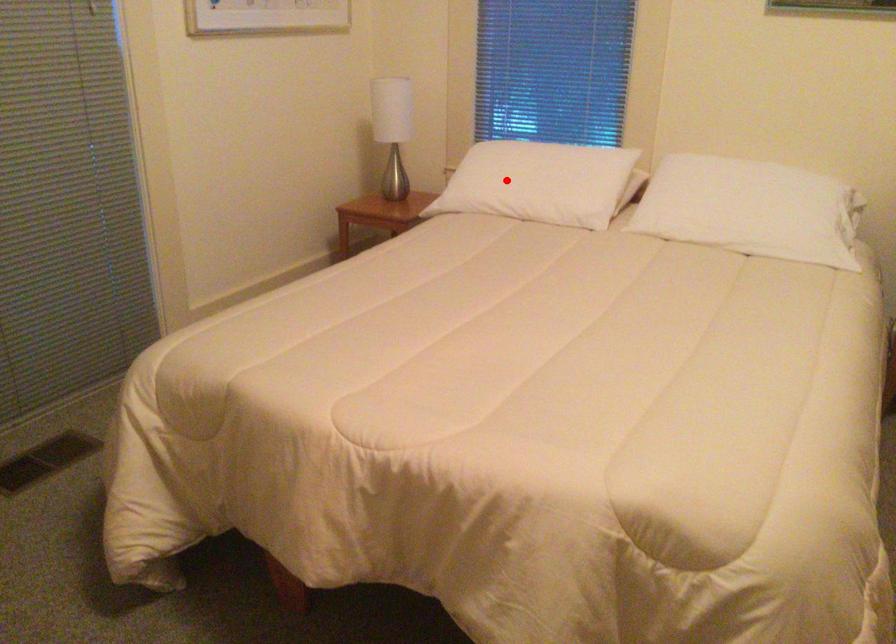
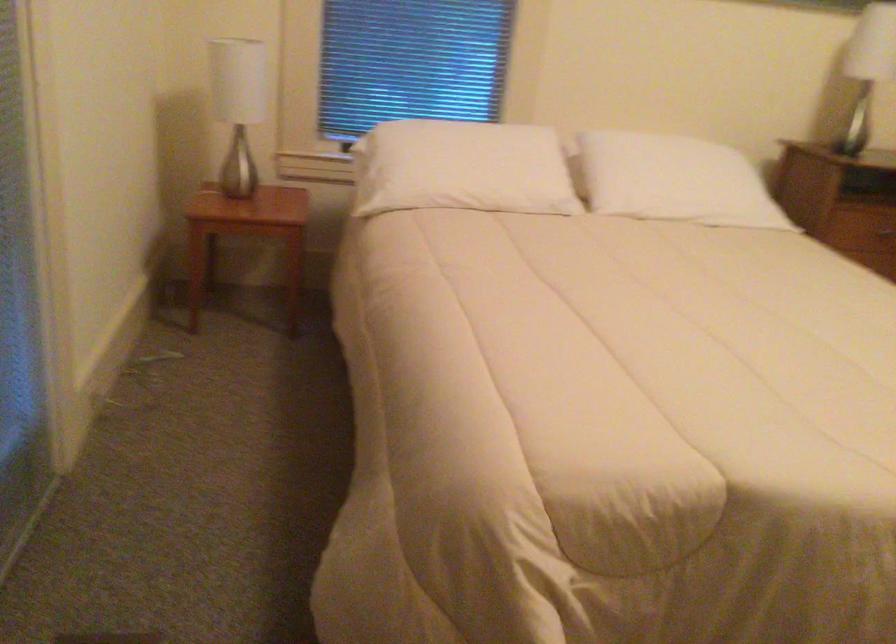
Locate, in the second image, the point that corresponds to the highlighted location in the first image.

(462, 167)